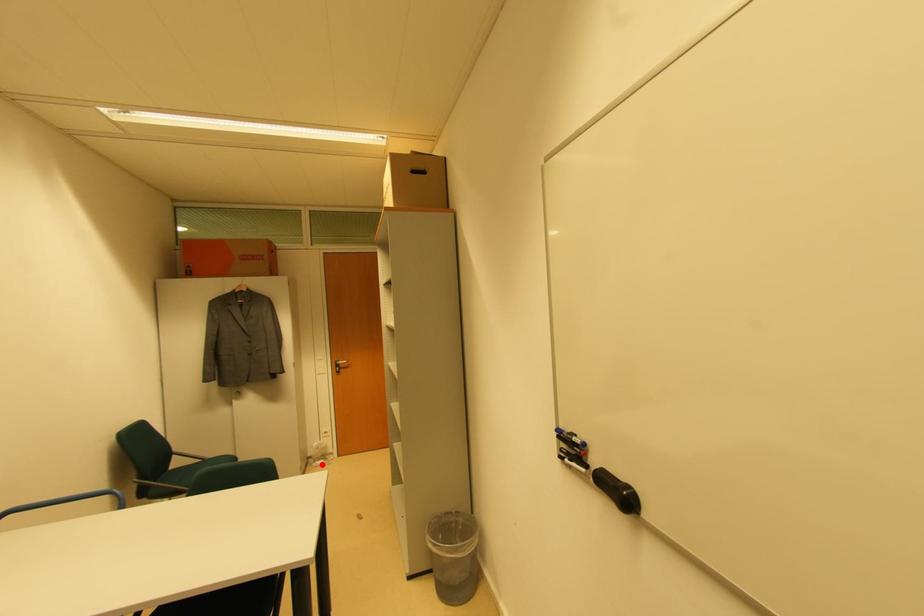
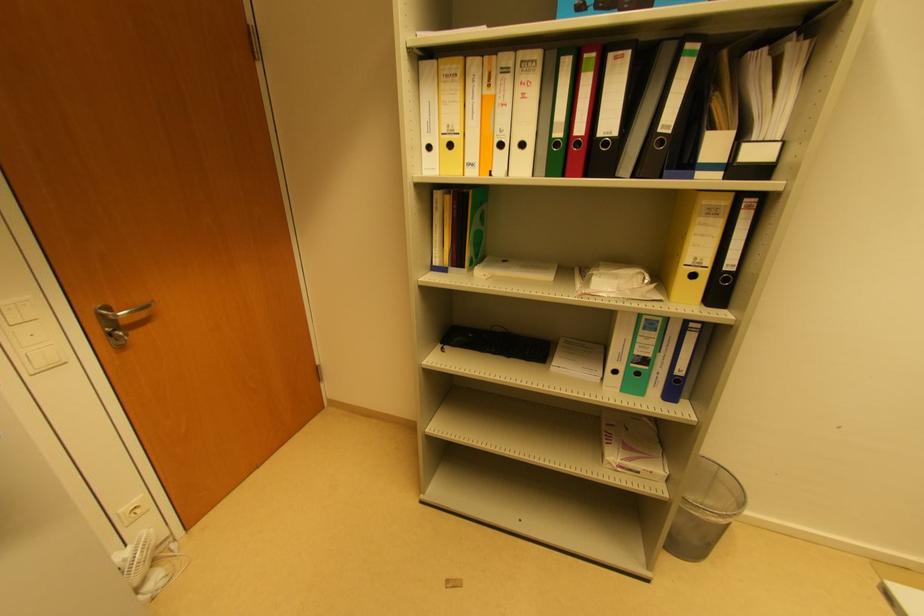
Question: I am providing you with two images of the same scene from different viewpoints. In image1, a red point is highlighted. Considering the same 3D point in image2, which of the following is correct?

Choices:
 (A) It is closer
 (B) It is farther

Answer: (A)